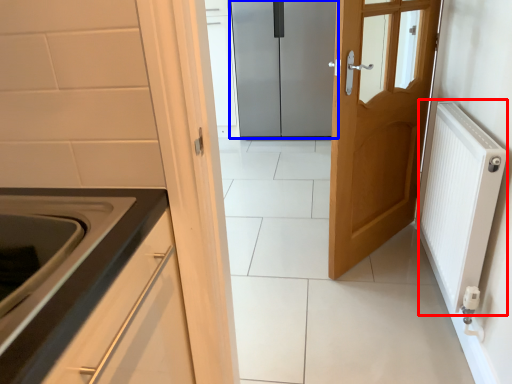
Question: Which of the following is the farthest to the observer, radiator (highlighted by a red box) or door (highlighted by a blue box)?

Choices:
 (A) radiator
 (B) door

Answer: (B)